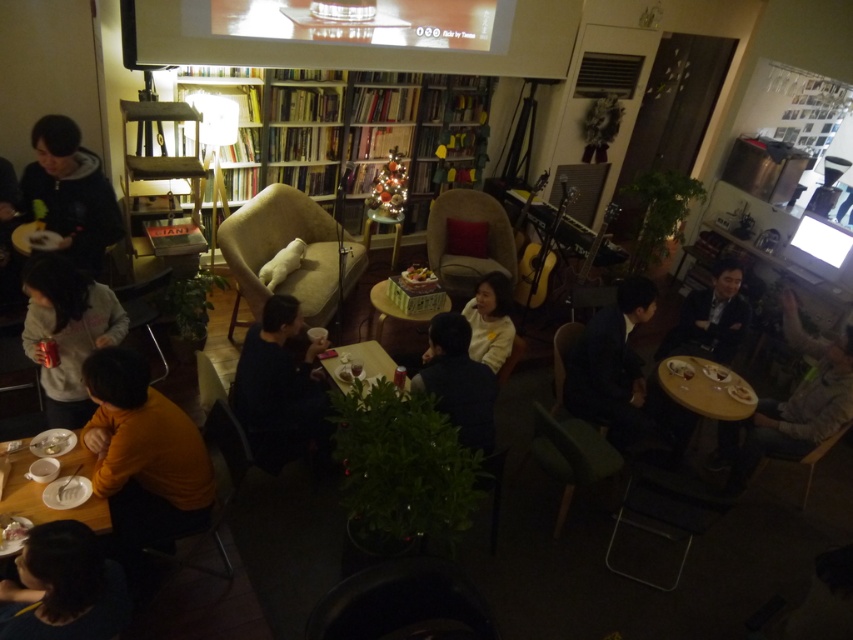
Between point (729, 332) and point (413, 316), which one is positioned in front?

Point (413, 316) is in front.

Which of these two, dark suit at right or green cardboard box at center, stands taller?

With more height is dark suit at right.

Is point (734, 273) positioned after point (376, 301)?

That is True.

Find the location of `dark suit at right`. dark suit at right is located at coordinates (711, 317).

Between dark gray hoodie at left and white matte shirt at center, which one is positioned higher?

Positioned higher is dark gray hoodie at left.

Which is behind, point (83, 157) or point (490, 272)?

Positioned behind is point (490, 272).

The width and height of the screenshot is (853, 640). Identify the location of dark gray hoodie at left. (68, 193).

Which of these two, white glossy table at lower left or wooden table at center, stands shorter?

Standing shorter between the two is wooden table at center.

Which is in front, point (94, 528) or point (339, 365)?

Point (94, 528)

Identify the location of white glossy table at lower left. This screenshot has width=853, height=640. (39, 493).

Image resolution: width=853 pixels, height=640 pixels. I want to click on white glossy table at lower left, so click(x=39, y=493).